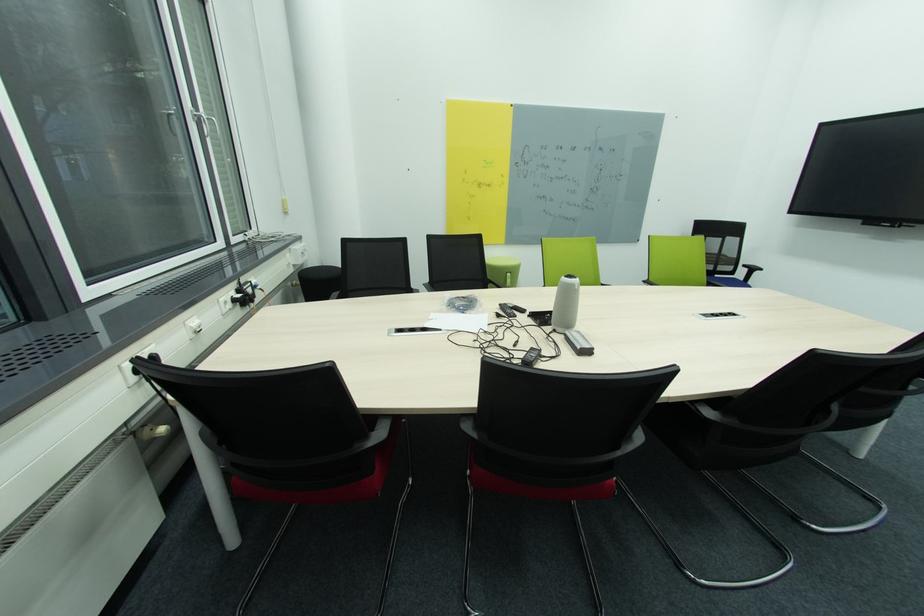
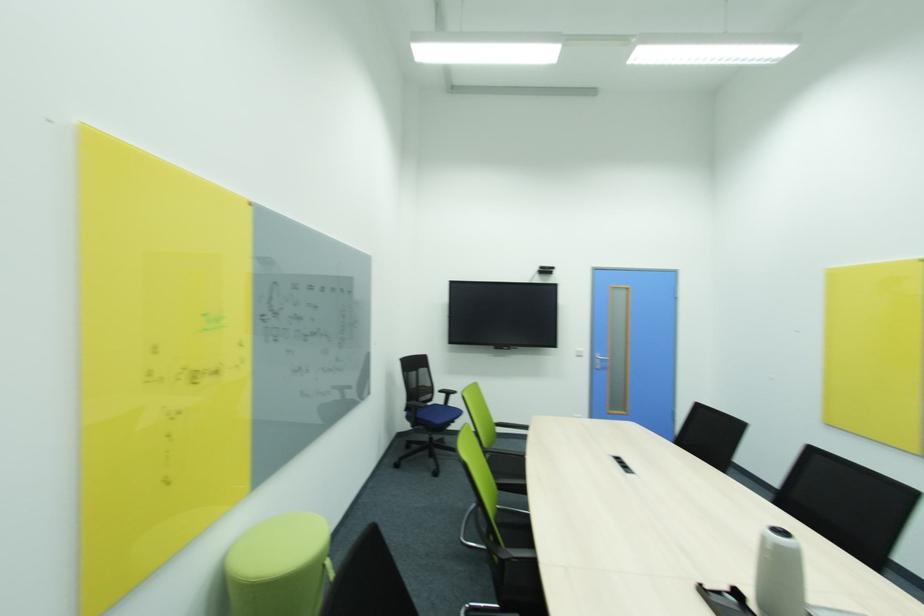
Find the pixel in the second image that matches pixel 736 241 in the first image.

(428, 371)